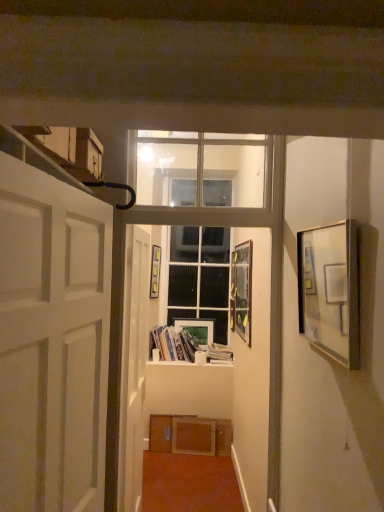
Question: Should I look upward or downward to see matte glass picture frame at center, which is the 3th picture frame from left to right?

Choices:
 (A) down
 (B) up

Answer: (A)

Question: From the image's perspective, would you say matte wooden picture frame at center, positioned as the 2th picture frame in left-to-right order, is shown under matte gold picture frame at center, acting as the 2th picture frame starting from the back?

Choices:
 (A) no
 (B) yes

Answer: (B)

Question: From a real-world perspective, is matte wooden picture frame at center, the 4th picture frame in the front-to-back sequence, below matte gold picture frame at center, the 1th picture frame from the left?

Choices:
 (A) no
 (B) yes

Answer: (B)

Question: Is matte wooden picture frame at center, arranged as the third picture frame when viewed from the right, bigger than matte gold picture frame at center, the third picture frame from the front?

Choices:
 (A) yes
 (B) no

Answer: (B)

Question: Is matte gold picture frame at center, arranged as the 4th picture frame when viewed from the right, located within matte wooden picture frame at center, placed as the 1th picture frame when sorted from back to front?

Choices:
 (A) yes
 (B) no

Answer: (B)

Question: Considering the relative positions of matte wooden picture frame at center, placed as the 1th picture frame when sorted from back to front, and matte gold picture frame at center, arranged as the 4th picture frame when viewed from the right, in the image provided, is matte wooden picture frame at center, placed as the 1th picture frame when sorted from back to front, behind matte gold picture frame at center, arranged as the 4th picture frame when viewed from the right,?

Choices:
 (A) yes
 (B) no

Answer: (A)

Question: From a real-world perspective, is matte wooden picture frame at center, arranged as the third picture frame when viewed from the right, on matte gold picture frame at center, the 1th picture frame from the left?

Choices:
 (A) no
 (B) yes

Answer: (A)

Question: Does matte glass picture frame at center, placed as the 2th picture frame when sorted from front to back, turn towards matte wooden picture frame at center, the 4th picture frame in the front-to-back sequence?

Choices:
 (A) no
 (B) yes

Answer: (A)

Question: Does matte glass picture frame at center, the 3th picture frame viewed from the back, appear on the right side of matte wooden picture frame at center, placed as the 1th picture frame when sorted from back to front?

Choices:
 (A) yes
 (B) no

Answer: (A)

Question: From the image's perspective, is matte glass picture frame at center, the 3th picture frame viewed from the back, over matte wooden picture frame at center, positioned as the 2th picture frame in left-to-right order?

Choices:
 (A) yes
 (B) no

Answer: (A)

Question: Does matte glass picture frame at center, the 3th picture frame viewed from the back, have a larger size compared to matte wooden picture frame at center, the 4th picture frame in the front-to-back sequence?

Choices:
 (A) yes
 (B) no

Answer: (A)

Question: Can you confirm if matte glass picture frame at center, the 3th picture frame viewed from the back, is thinner than matte wooden picture frame at center, placed as the 1th picture frame when sorted from back to front?

Choices:
 (A) no
 (B) yes

Answer: (A)

Question: From a real-world perspective, is matte glass picture frame at center, placed as the 2th picture frame when sorted from front to back, positioned over matte wooden picture frame at center, the 4th picture frame in the front-to-back sequence, based on gravity?

Choices:
 (A) yes
 (B) no

Answer: (A)

Question: Is matte gold picture frame at center, arranged as the 4th picture frame when viewed from the right, taller than white matte door at center, positioned as the second door in front-to-back order?

Choices:
 (A) no
 (B) yes

Answer: (A)